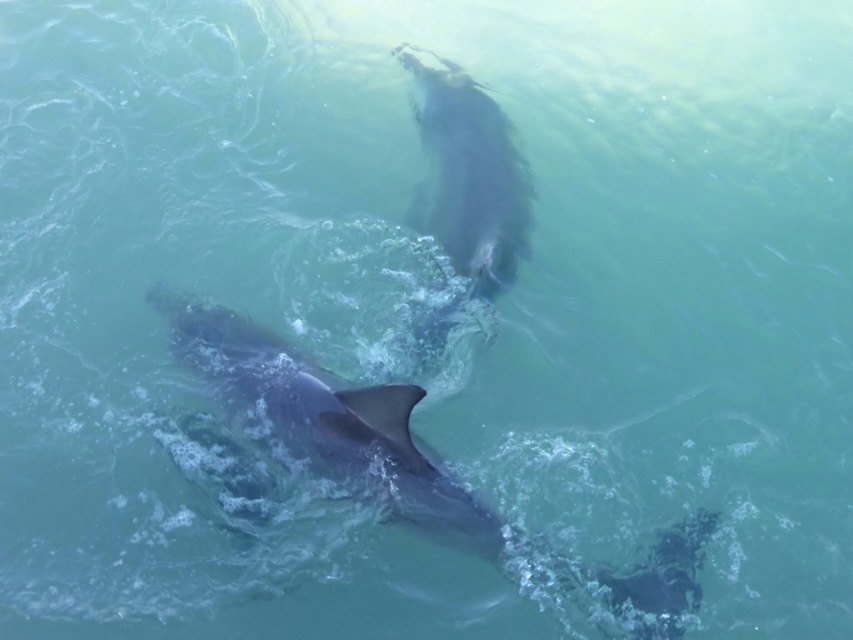
In the scene shown: You are a marine biologist observing two marine animals in the water. You see the gray smooth dolphin at center and the gray matte whale at upper center. Which one is bigger?

The gray smooth dolphin at center is larger in size than the gray matte whale at upper center.

You are a marine biologist observing two marine animals in the water. You see the gray smooth dolphin at center and the gray matte whale at upper center. Which one has a smaller height?

The gray smooth dolphin at center has a lesser height compared to the gray matte whale at upper center, so the gray smooth dolphin at center is smaller in height.

You are a marine biologist observing two dolphins in the water. You notice the gray smooth dolphin at center. Based on its position coordinates, can you determine if it is closer to the surface or deeper underwater?

The gray smooth dolphin at center is positioned at coordinates point (334, 420). Since the y coordinate is 0.392, which is closer to 0.5 than 0, it is approximately halfway between the surface and the bottom, so it is neither close to the surface nor the bottom.